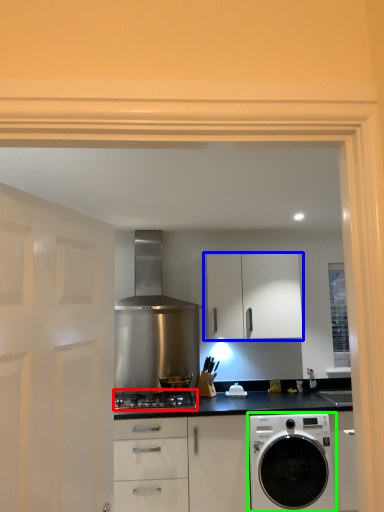
Question: Which is farther away from gas stove (highlighted by a red box)? cabinetry (highlighted by a blue box) or washing machine (highlighted by a green box)?

Choices:
 (A) cabinetry
 (B) washing machine

Answer: (A)